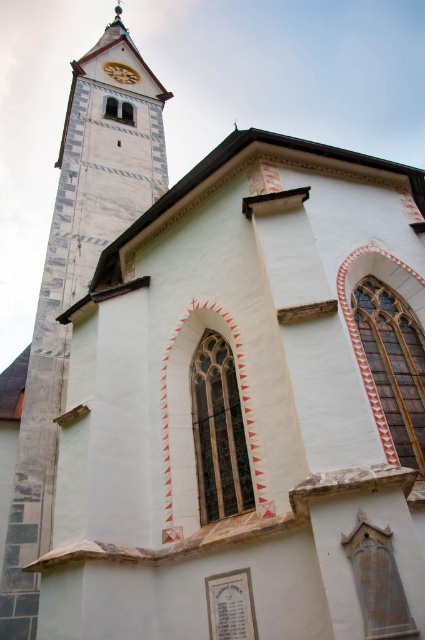
Question: Can you confirm if speckled stone tower at left is positioned to the right of wooden clock face at upper center?

Choices:
 (A) no
 (B) yes

Answer: (B)

Question: Which point appears farthest from the camera in this image?

Choices:
 (A) (47, 436)
 (B) (113, 77)

Answer: (B)

Question: Where is speckled stone tower at left located in relation to wooden clock face at upper center in the image?

Choices:
 (A) right
 (B) left

Answer: (A)

Question: Among these objects, which one is nearest to the camera?

Choices:
 (A) wooden clock face at upper center
 (B) speckled stone tower at left

Answer: (B)

Question: Where is speckled stone tower at left located in relation to wooden clock face at upper center in the image?

Choices:
 (A) above
 (B) below

Answer: (B)